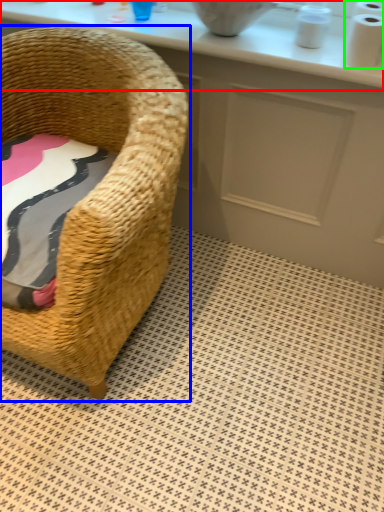
Question: Which object is the closest to the counter top (highlighted by a red box)? Choose among these: chair (highlighted by a blue box) or toilet paper (highlighted by a green box).

Choices:
 (A) chair
 (B) toilet paper

Answer: (B)